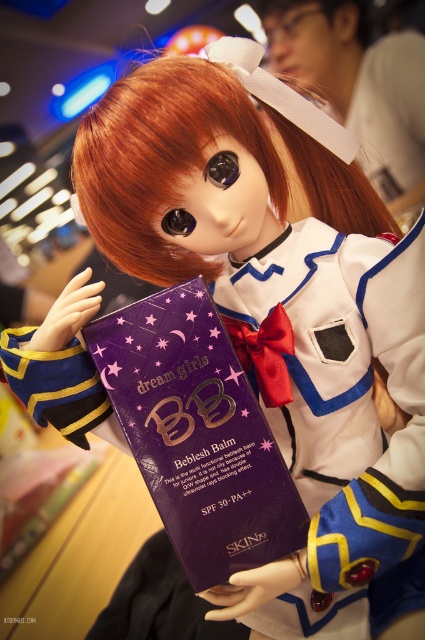
You are a makeup artist preparing to apply the purple matte bb cream at center and the shiny orange hair at center on a doll. Since both items are at the center, which one is located lower?

The purple matte bb cream at center is positioned under the shiny orange hair at center, so it is located lower.

What is located at the point with coordinates (198,433) in the image?

The point at coordinates (198,433) indicates the purple matte bb cream at center.